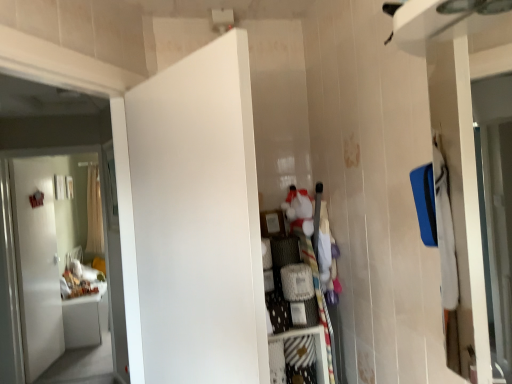
Question: Considering the relative sizes of white sheer curtain at left and white matte door at left, placed as the 1th door when sorted from back to front, in the image provided, is white sheer curtain at left taller than white matte door at left, placed as the 1th door when sorted from back to front,?

Choices:
 (A) no
 (B) yes

Answer: (A)

Question: Is white sheer curtain at left touching white matte door at left, placed as the 1th door when sorted from back to front?

Choices:
 (A) no
 (B) yes

Answer: (A)

Question: Is white sheer curtain at left to the left of white matte door at left, which is the second door from right to left, from the viewer's perspective?

Choices:
 (A) no
 (B) yes

Answer: (B)

Question: Is white sheer curtain at left positioned before white matte door at left, marked as the 2th door in a front-to-back arrangement?

Choices:
 (A) no
 (B) yes

Answer: (A)

Question: Is white sheer curtain at left oriented away from white matte door at left, which is the second door from right to left?

Choices:
 (A) yes
 (B) no

Answer: (B)

Question: Is white sheer curtain at left located outside white matte door at left, which is the second door from right to left?

Choices:
 (A) no
 (B) yes

Answer: (B)

Question: Is white fabric dresser at center with white matte door at left, which is the second door from right to left?

Choices:
 (A) no
 (B) yes

Answer: (A)

Question: Is white fabric dresser at center aimed at white matte door at left, placed as the 1th door when sorted from back to front?

Choices:
 (A) yes
 (B) no

Answer: (B)

Question: From a real-world perspective, does white fabric dresser at center sit lower than white matte door at left, marked as the 2th door in a front-to-back arrangement?

Choices:
 (A) no
 (B) yes

Answer: (A)

Question: From the image's perspective, is white fabric dresser at center located beneath white matte door at left, marked as the 1th door in a left-to-right arrangement?

Choices:
 (A) no
 (B) yes

Answer: (A)

Question: Would you say white matte door at left, marked as the 2th door in a front-to-back arrangement, is part of white fabric dresser at center's contents?

Choices:
 (A) no
 (B) yes

Answer: (A)

Question: Does white fabric dresser at center have a greater height compared to white matte door at left, marked as the 1th door in a left-to-right arrangement?

Choices:
 (A) yes
 (B) no

Answer: (B)

Question: Is white fabric dresser at center next to white matte door at center, positioned as the first door in right-to-left order, and touching it?

Choices:
 (A) no
 (B) yes

Answer: (A)